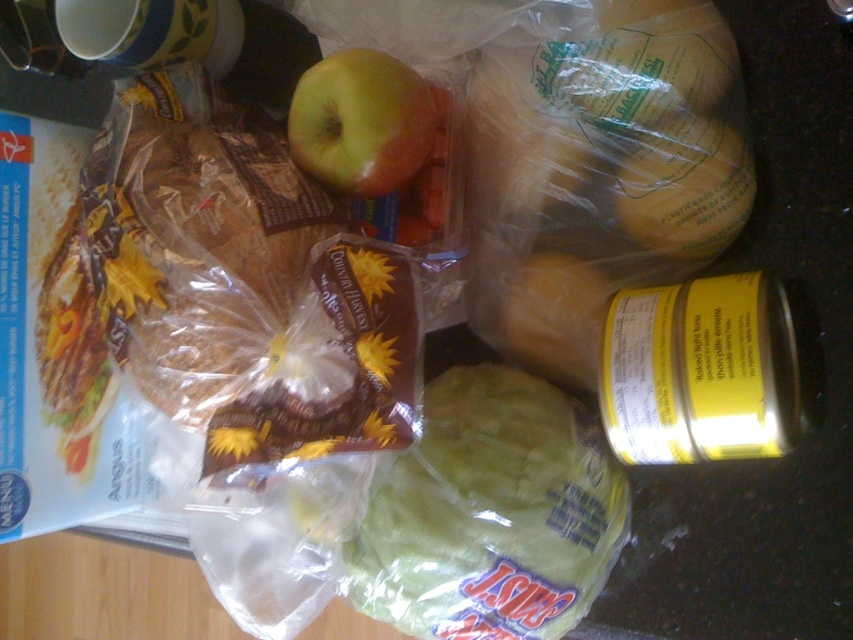
Is point (520, 516) less distant than point (369, 84)?

No, it is not.

Between green plastic cabbage at center and green matte apple at center, which one has more height?

With more height is green plastic cabbage at center.

The image size is (853, 640). I want to click on green plastic cabbage at center, so click(490, 515).

This screenshot has width=853, height=640. Find the location of `green plastic cabbage at center`. green plastic cabbage at center is located at coordinates (490, 515).